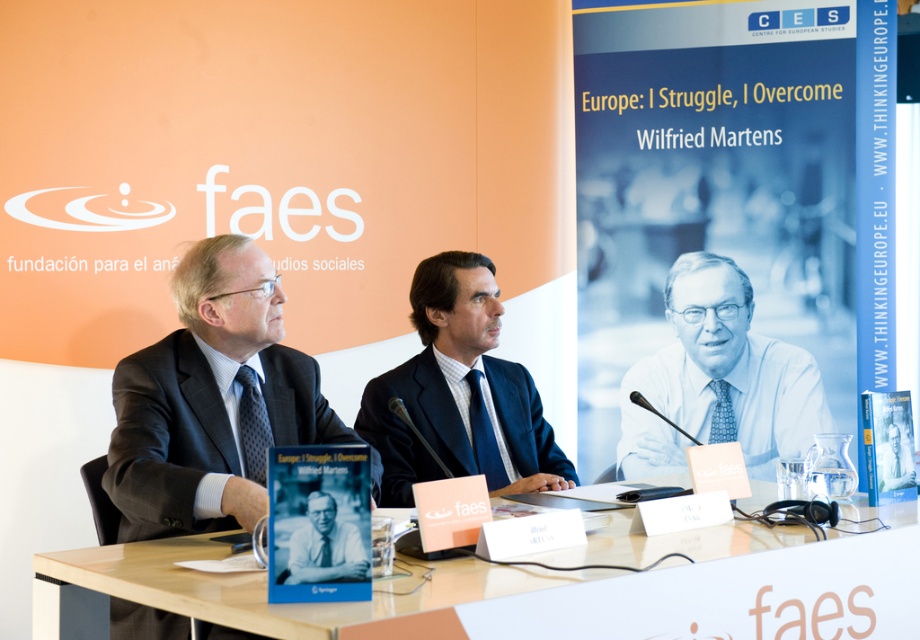
You are organizing a photo shoot for a men fashion magazine and need to arrange two models wearing the dark gray suit at left and dark blue suit at center. The requirement is that the taller model should stand behind the shorter one to create a layered look. Based on the image, which suit should be placed behind the other?

The dark gray suit at left is taller than dark blue suit at center, so the dark gray suit at left should be placed behind the dark blue suit at center to create the layered look.